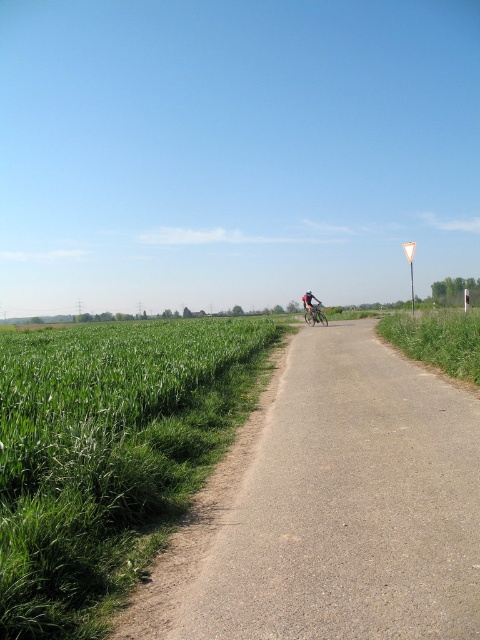
Can you confirm if asphalt road at center is taller than shiny metallic bicycle at center?

No, asphalt road at center is not taller than shiny metallic bicycle at center.

Between asphalt road at center and shiny metallic bicycle at center, which one is positioned lower?

asphalt road at center is lower down.

Which is behind, point (365, 400) or point (326, 323)?

The point (326, 323) is behind.

I want to click on asphalt road at center, so click(x=332, y=508).

Who is more forward, (177, 346) or (303, 307)?

Point (177, 346) is more forward.

What do you see at coordinates (108, 454) in the screenshot? The height and width of the screenshot is (640, 480). I see `green grassy field at left` at bounding box center [108, 454].

You are a GUI agent. You are given a task and a screenshot of the screen. Output one action in this format:
    pyautogui.click(x=<x>, y=<y>)
    Task: Click on the green grassy field at left
    This screenshot has width=480, height=640.
    Given the screenshot: What is the action you would take?
    [108, 454]

Between asphalt road at center and green grassy field at left, which one appears on the right side from the viewer's perspective?

Positioned to the right is asphalt road at center.

From the picture: Does asphalt road at center appear on the left side of green grassy field at left?

In fact, asphalt road at center is to the right of green grassy field at left.

Between point (360, 339) and point (26, 397), which one is positioned behind?

Positioned behind is point (360, 339).

Locate an element on the screen. This screenshot has height=640, width=480. asphalt road at center is located at coordinates [x=332, y=508].